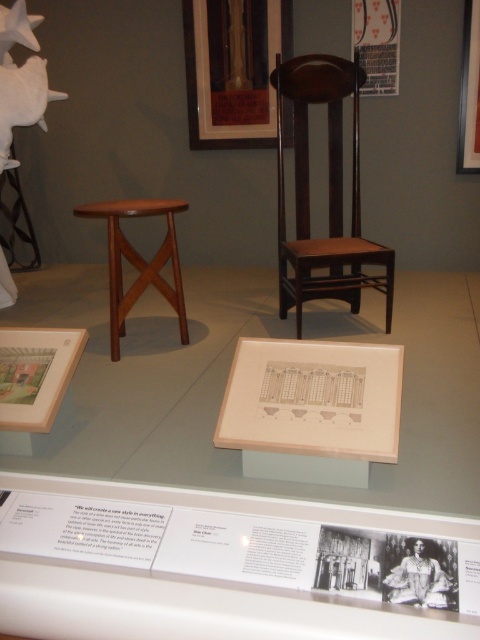
Question: Considering the real-world distances, which object is farthest from the matte wooden picture frame at lower left?

Choices:
 (A) matte wood picture frame at upper center
 (B) mahogany wood chair at center

Answer: (A)

Question: Is matte wood picture frame at upper center wider than matte white picture frame at upper right?

Choices:
 (A) no
 (B) yes

Answer: (B)

Question: Among these points, which one is farthest from the camera?

Choices:
 (A) tap(475, 154)
 (B) tap(196, 24)
 (C) tap(135, 280)
 (D) tap(17, 358)

Answer: (B)

Question: Is matte wood picture frame at upper center smaller than matte wooden picture frame at lower left?

Choices:
 (A) yes
 (B) no

Answer: (B)

Question: Which object appears closest to the camera in this image?

Choices:
 (A) matte wood picture frame at upper center
 (B) mahogany wood stool at center
 (C) mahogany wood chair at center

Answer: (B)

Question: Can you confirm if matte wood picture frame at upper center is positioned below matte white picture frame at upper right?

Choices:
 (A) yes
 (B) no

Answer: (B)